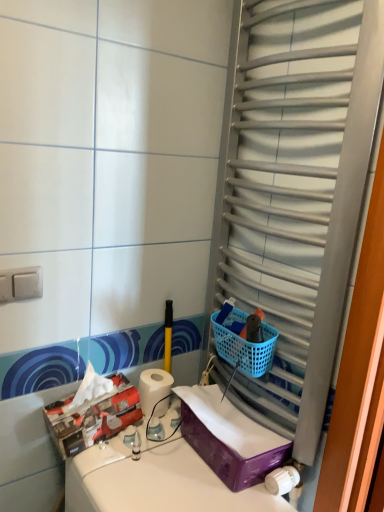
Question: Can you confirm if white plastic switch at upper left is shorter than purple plastic storage box at lower right, arranged as the first storage box when viewed from the right?

Choices:
 (A) no
 (B) yes

Answer: (B)

Question: Does white plastic switch at upper left appear on the right side of purple plastic storage box at lower right, placed as the second storage box when sorted from left to right?

Choices:
 (A) yes
 (B) no

Answer: (B)

Question: From the image's perspective, is white plastic switch at upper left under purple plastic storage box at lower right, arranged as the first storage box when viewed from the right?

Choices:
 (A) yes
 (B) no

Answer: (B)

Question: Is the position of white plastic switch at upper left less distant than that of purple plastic storage box at lower right, arranged as the first storage box when viewed from the right?

Choices:
 (A) no
 (B) yes

Answer: (B)

Question: Can you confirm if white plastic switch at upper left is taller than purple plastic storage box at lower right, arranged as the first storage box when viewed from the right?

Choices:
 (A) yes
 (B) no

Answer: (B)

Question: Is white plastic switch at upper left outside purple plastic storage box at lower right, arranged as the first storage box when viewed from the right?

Choices:
 (A) no
 (B) yes

Answer: (B)

Question: Is blue plastic basket at right not inside matte cardboard tissue box at lower left, which ranks as the second storage box in right-to-left order?

Choices:
 (A) no
 (B) yes

Answer: (B)

Question: Is blue plastic basket at right closer to the viewer compared to matte cardboard tissue box at lower left, positioned as the 1th storage box in left-to-right order?

Choices:
 (A) yes
 (B) no

Answer: (B)

Question: From the image's perspective, does blue plastic basket at right appear higher than matte cardboard tissue box at lower left, positioned as the 1th storage box in left-to-right order?

Choices:
 (A) yes
 (B) no

Answer: (A)

Question: Considering the relative sizes of blue plastic basket at right and matte cardboard tissue box at lower left, which ranks as the second storage box in right-to-left order, in the image provided, is blue plastic basket at right taller than matte cardboard tissue box at lower left, which ranks as the second storage box in right-to-left order,?

Choices:
 (A) yes
 (B) no

Answer: (B)

Question: Can you confirm if blue plastic basket at right is smaller than matte cardboard tissue box at lower left, positioned as the 1th storage box in left-to-right order?

Choices:
 (A) no
 (B) yes

Answer: (B)

Question: Considering the relative sizes of blue plastic basket at right and matte cardboard tissue box at lower left, positioned as the 1th storage box in left-to-right order, in the image provided, is blue plastic basket at right bigger than matte cardboard tissue box at lower left, positioned as the 1th storage box in left-to-right order,?

Choices:
 (A) yes
 (B) no

Answer: (B)

Question: From a real-world perspective, is white plastic switch at upper left positioned over matte cardboard tissue box at lower left, positioned as the 1th storage box in left-to-right order, based on gravity?

Choices:
 (A) no
 (B) yes

Answer: (B)